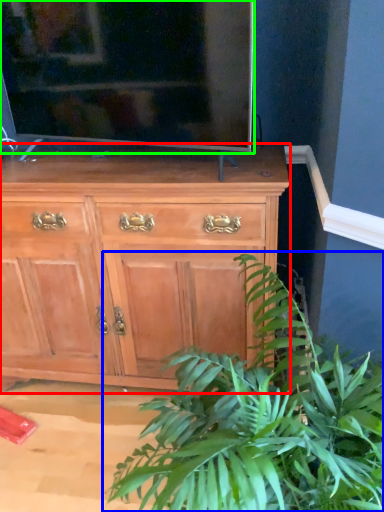
Question: Which object is positioned farthest from chest of drawers (highlighted by a red box)? Select from houseplant (highlighted by a blue box) and television (highlighted by a green box).

Choices:
 (A) houseplant
 (B) television

Answer: (A)